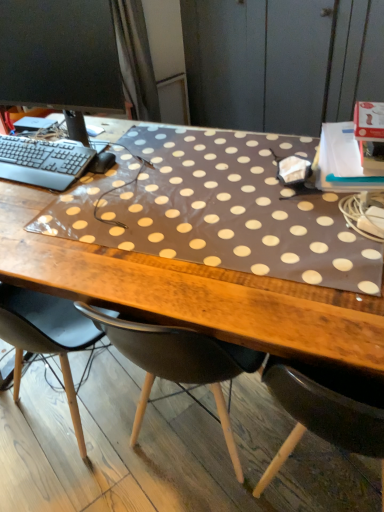
Find the location of a particular element. Image resolution: width=384 pixels, height=512 pixels. vacant space in front of black matte mouse at center is located at coordinates (95, 190).